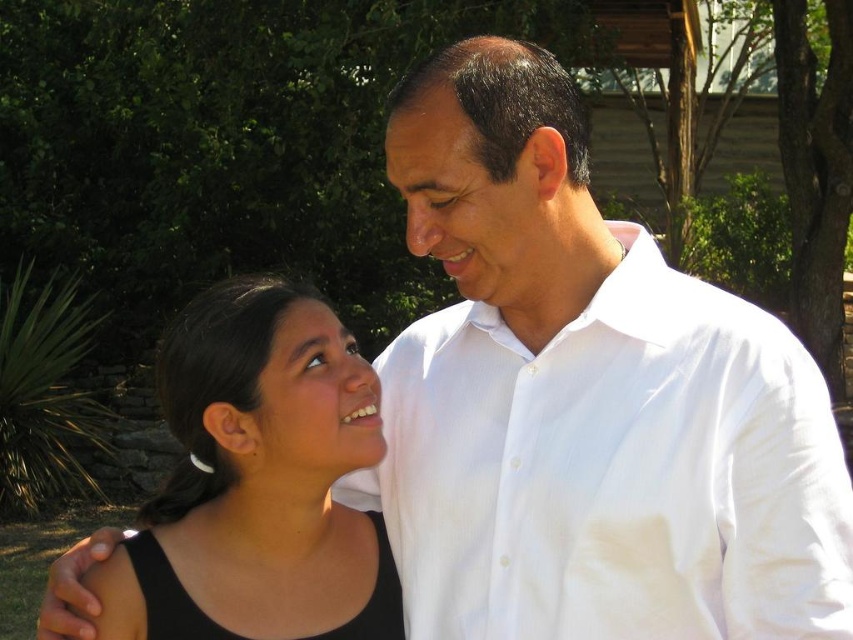
You are an artist sketching this scene and want to ensure proportions are accurate. Which object in the image has a greater height between the white cotton shirt at upper right and the black matte tank top at center?

The white cotton shirt at upper right has a greater height compared to the black matte tank top at center according to the description.

Consider the image. You are a photographer setting up for a group photo. You need to ensure there is enough space between the white cotton shirt at upper right and the black matte tank top at center so that both subjects are clearly visible. Given that the minimum required distance for clear visibility is 12 inches, is the current distance sufficient?

The white cotton shirt at upper right is 12.31 inches from the black matte tank top at center, which exceeds the minimum required distance of 12 inches. Therefore, the current distance is sufficient for both subjects to be clearly visible.

You are standing in the park and see the point at coordinates (x=613, y=470). What object is located at that point?

The point at coordinates (x=613, y=470) corresponds to the white cotton shirt at upper right.